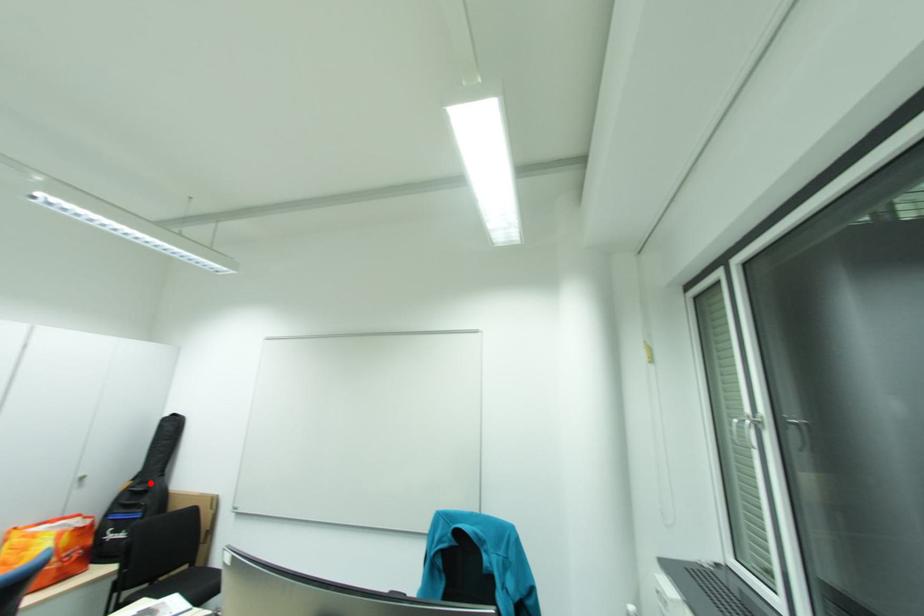
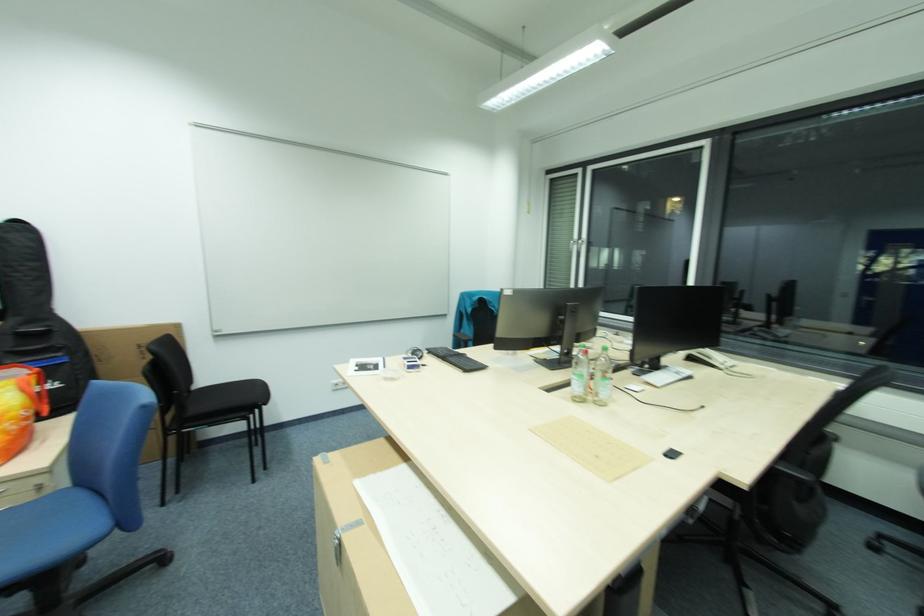
Question: I am providing you with two images of the same scene from different viewpoints. Image1 has a red point marked. In image2, the corresponding 3D location appears at what relative position? Reply with the corresponding letter.

Choices:
 (A) Closer
 (B) Farther

Answer: (B)